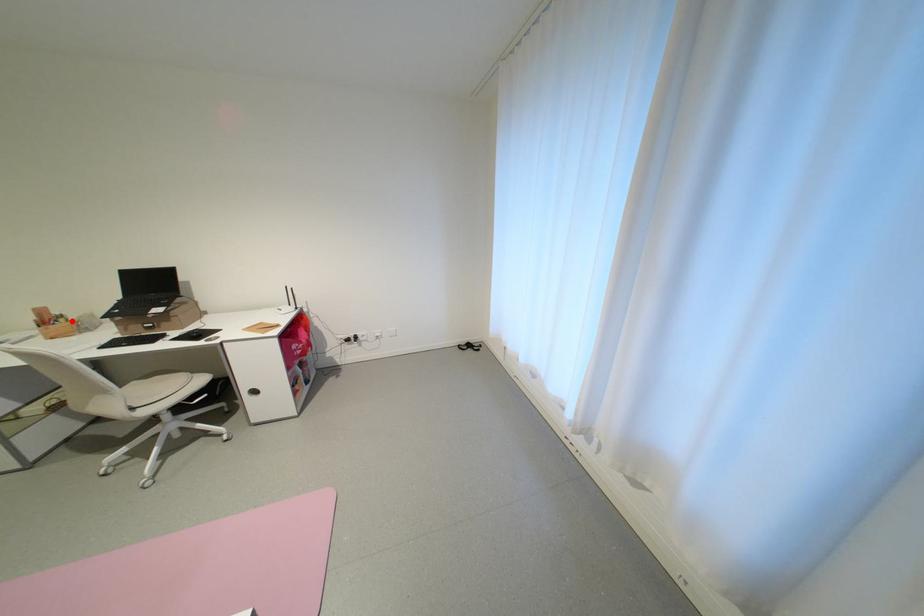
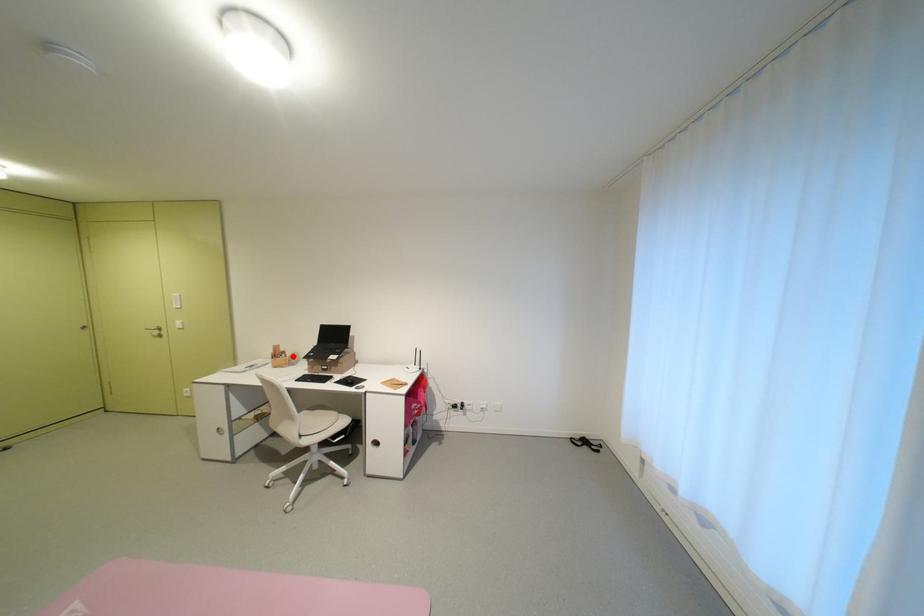
I am providing you with two images of the same scene from different viewpoints. A red point is marked on the first image and another point is marked on the second image. Is the red point in image1 aligned with the point shown in image2?

Yes